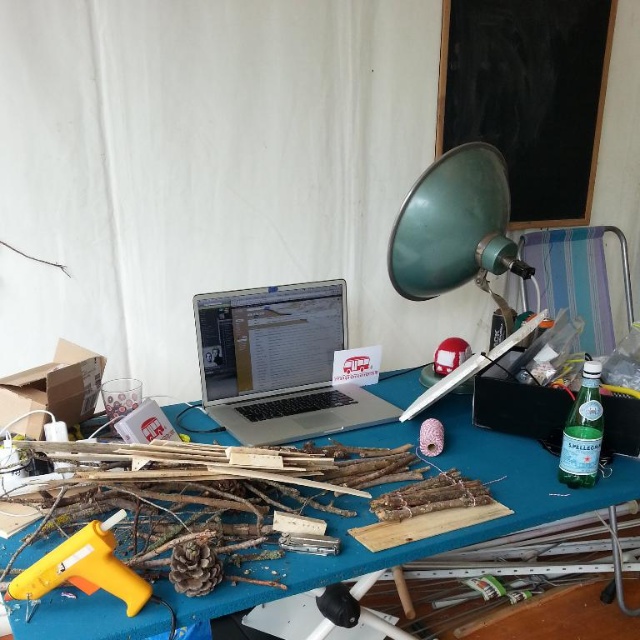
Question: Is green matte lampshade at upper right thinner than yellow plastic glue gun at lower left?

Choices:
 (A) no
 (B) yes

Answer: (A)

Question: Is blue wood table at center closer to the viewer compared to yellow plastic glue gun at lower left?

Choices:
 (A) yes
 (B) no

Answer: (A)

Question: Which of the following is the closest to the observer?

Choices:
 (A) (362, 444)
 (B) (58, 580)
 (C) (440, 268)
 (D) (330, 403)

Answer: (B)

Question: Which of the following is the closest to the observer?

Choices:
 (A) silver metallic laptop at center
 (B) blue wood table at center
 (C) yellow plastic glue gun at lower left

Answer: (B)

Question: Which of the following is the closest to the observer?

Choices:
 (A) (472, 529)
 (B) (497, 205)
 (C) (128, 572)

Answer: (C)

Question: Is blue wood table at center thinner than yellow plastic glue gun at lower left?

Choices:
 (A) no
 (B) yes

Answer: (A)